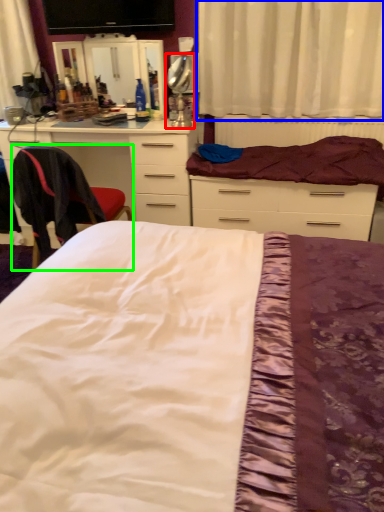
Question: Which object is positioned farthest from table lamp (highlighted by a red box)? Select from curtain (highlighted by a blue box) and chair (highlighted by a green box).

Choices:
 (A) curtain
 (B) chair

Answer: (B)